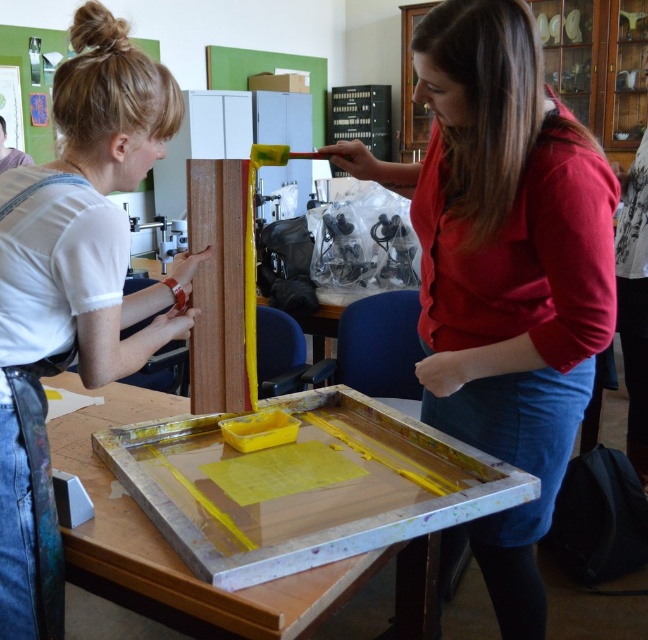
Question: Which object is the farthest from the matte red blouse at center?

Choices:
 (A) wooden plank at center
 (B) wooden tray at center

Answer: (A)

Question: Estimate the real-world distances between objects in this image. Which object is farther from the wooden plank at center?

Choices:
 (A) wooden tray at center
 (B) matte red blouse at center

Answer: (B)

Question: Is matte red blouse at center positioned behind white matte shirt at upper left?

Choices:
 (A) no
 (B) yes

Answer: (B)

Question: Can you confirm if matte red blouse at center is positioned below wooden plank at center?

Choices:
 (A) no
 (B) yes

Answer: (B)

Question: Does white matte shirt at upper left lie in front of wooden plank at center?

Choices:
 (A) no
 (B) yes

Answer: (B)

Question: Which of the following is the farthest from the observer?

Choices:
 (A) wooden tray at center
 (B) matte red blouse at center

Answer: (B)